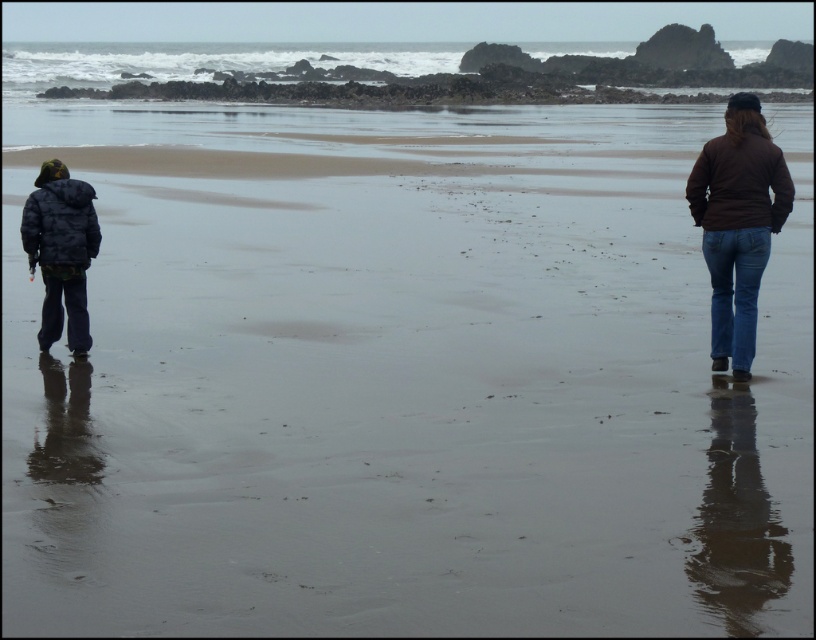
Question: Which object appears farthest from the camera in this image?

Choices:
 (A) camouflage jacket at left
 (B) blue denim jeans at right
 (C) brown matte jacket at right
 (D) brown denim jeans at right

Answer: (A)

Question: Can you confirm if camouflage jacket at left is smaller than dark blue jeans at lower left?

Choices:
 (A) no
 (B) yes

Answer: (A)

Question: Does camouflage jacket at left have a larger size compared to blue denim jeans at right?

Choices:
 (A) yes
 (B) no

Answer: (A)

Question: Which object is positioned farthest from the gray wet sand at upper center?

Choices:
 (A) brown matte jacket at right
 (B) camouflage jacket at left
 (C) dark gray puffy jacket at left

Answer: (B)

Question: Can you confirm if camouflage jacket at left is bigger than brown matte jacket at right?

Choices:
 (A) no
 (B) yes

Answer: (B)

Question: Which of the following is the farthest from the observer?

Choices:
 (A) blue denim jeans at right
 (B) gray wet sand at upper center
 (C) dark gray puffy jacket at left
 (D) dark blue jeans at lower left

Answer: (B)